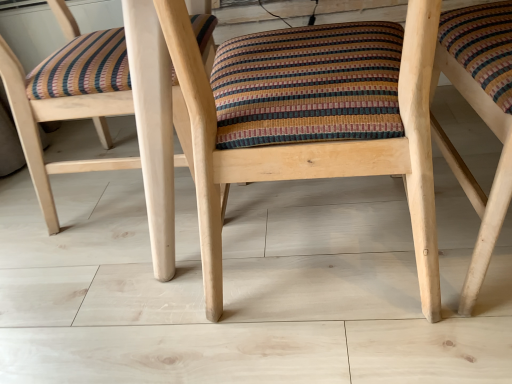
Question: Is wooden chair at center, marked as the first chair in a left-to-right arrangement, next to natural wood chair at center, the 1th chair viewed from the right?

Choices:
 (A) no
 (B) yes

Answer: (A)

Question: Is wooden chair at center, positioned as the 3th chair in right-to-left order, bigger than natural wood chair at center, the 3th chair when ordered from left to right?

Choices:
 (A) yes
 (B) no

Answer: (A)

Question: Is wooden chair at center, positioned as the 3th chair in right-to-left order, taller than natural wood chair at center, the 3th chair when ordered from left to right?

Choices:
 (A) yes
 (B) no

Answer: (B)

Question: From a real-world perspective, is wooden chair at center, positioned as the 3th chair in right-to-left order, physically above natural wood chair at center, the 3th chair when ordered from left to right?

Choices:
 (A) no
 (B) yes

Answer: (B)

Question: Considering the relative sizes of wooden chair at center, positioned as the 3th chair in right-to-left order, and natural wood chair at center, the 1th chair viewed from the right, in the image provided, is wooden chair at center, positioned as the 3th chair in right-to-left order, shorter than natural wood chair at center, the 1th chair viewed from the right,?

Choices:
 (A) yes
 (B) no

Answer: (A)

Question: In the image, is natural wood chair at center, the 1th chair viewed from the right, positioned in front of or behind wooden chair at center, positioned as the 3th chair in right-to-left order?

Choices:
 (A) front
 (B) behind

Answer: (A)

Question: Visually, is natural wood chair at center, the 1th chair viewed from the right, positioned to the left or to the right of wooden chair at center, marked as the first chair in a left-to-right arrangement?

Choices:
 (A) right
 (B) left

Answer: (A)

Question: Which is correct: natural wood chair at center, the 1th chair viewed from the right, is inside wooden chair at center, marked as the first chair in a left-to-right arrangement, or outside of it?

Choices:
 (A) outside
 (B) inside

Answer: (A)

Question: Looking at their shapes, would you say natural wood chair at center, the 3th chair when ordered from left to right, is wider or thinner than wooden chair at center, marked as the first chair in a left-to-right arrangement?

Choices:
 (A) wide
 (B) thin

Answer: (A)

Question: From the image's perspective, is wooden chair at center, positioned as the 2th chair in right-to-left order, located above or below natural wood chair at center, the 1th chair viewed from the right?

Choices:
 (A) below
 (B) above

Answer: (A)

Question: Is wooden chair at center, positioned as the 2th chair in right-to-left order, to the left or to the right of natural wood chair at center, the 3th chair when ordered from left to right, in the image?

Choices:
 (A) right
 (B) left

Answer: (B)

Question: From a real-world perspective, is wooden chair at center, which appears as the 2th chair when viewed from the left, positioned above or below natural wood chair at center, the 1th chair viewed from the right?

Choices:
 (A) above
 (B) below

Answer: (A)

Question: Does point (415, 122) appear closer or farther from the camera than point (503, 183)?

Choices:
 (A) closer
 (B) farther

Answer: (A)

Question: Is wooden chair at center, marked as the first chair in a left-to-right arrangement, taller or shorter than natural wood chair at center, the 3th chair when ordered from left to right?

Choices:
 (A) tall
 (B) short

Answer: (B)

Question: From the image's perspective, is wooden chair at center, positioned as the 3th chair in right-to-left order, located above or below natural wood chair at center, the 1th chair viewed from the right?

Choices:
 (A) above
 (B) below

Answer: (A)